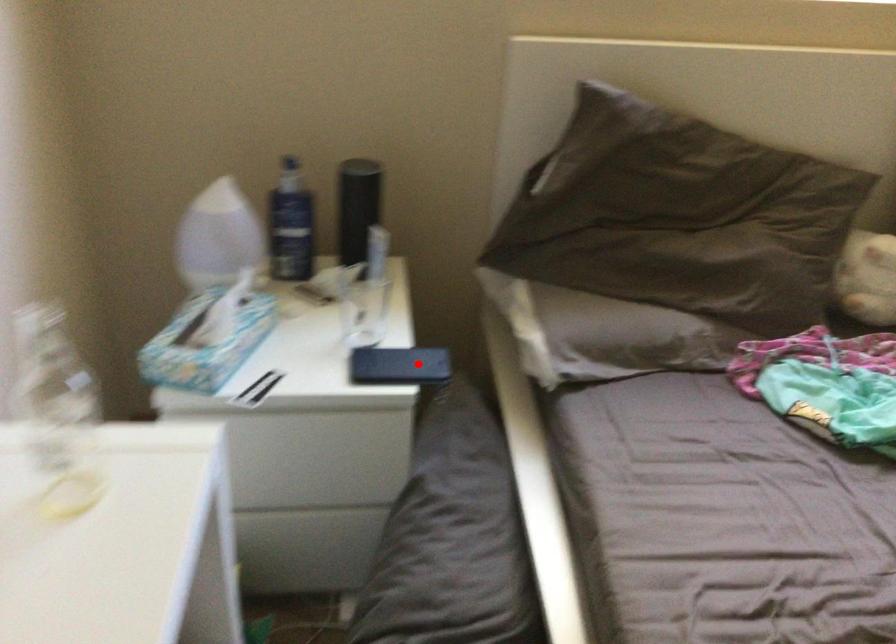
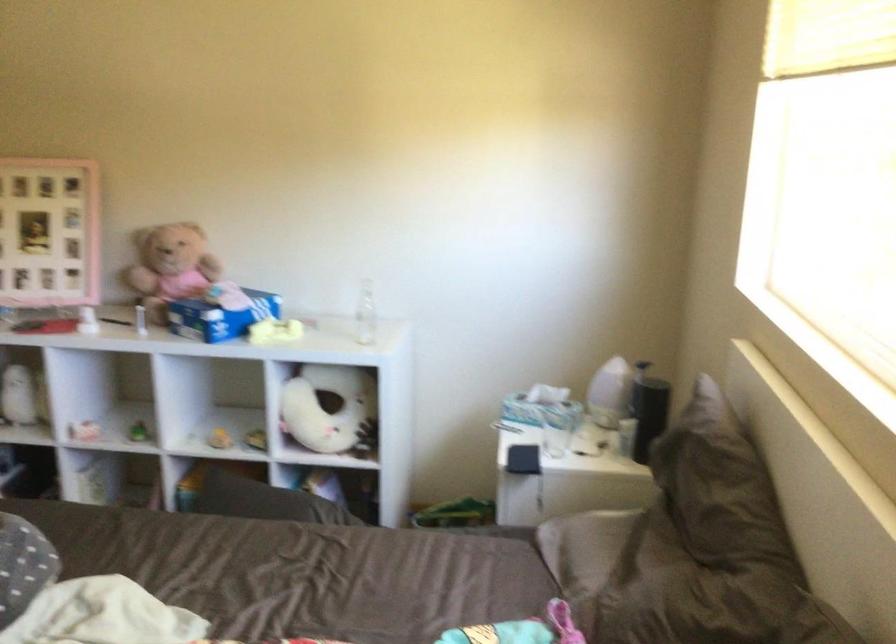
Find the pixel in the second image that matches the highlighted location in the first image.

(522, 459)